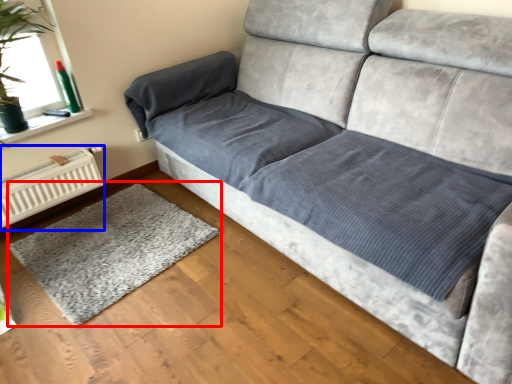
Question: Which point is further to the camera, mat (highlighted by a red box) or radiator (highlighted by a blue box)?

Choices:
 (A) mat
 (B) radiator

Answer: (B)